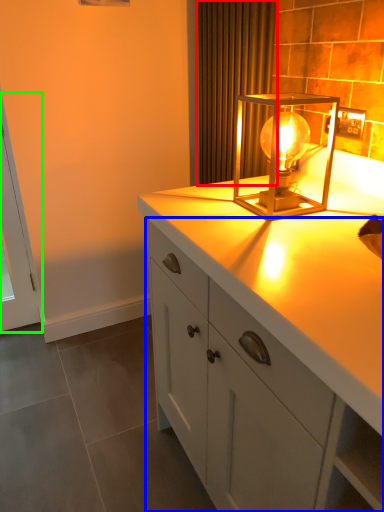
Question: Which is farther away from curtain (highlighted by a red box)? cabinetry (highlighted by a blue box) or screen door (highlighted by a green box)?

Choices:
 (A) cabinetry
 (B) screen door

Answer: (B)